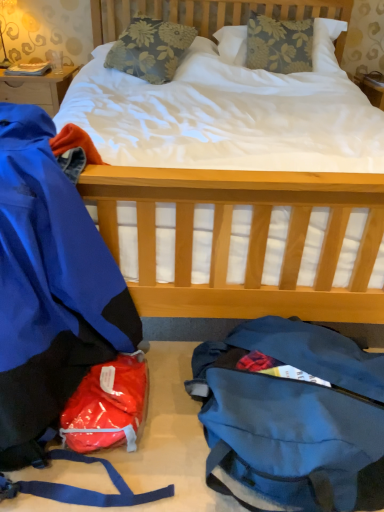
Question: In terms of height, does hardcover book at upper left look taller or shorter compared to blue waterproof jacket at left?

Choices:
 (A) short
 (B) tall

Answer: (A)

Question: Looking at the image, does hardcover book at upper left seem bigger or smaller compared to blue waterproof jacket at left?

Choices:
 (A) small
 (B) big

Answer: (A)

Question: Which object is positioned farthest from the blue waterproof jacket at left?

Choices:
 (A) hardcover book at upper left
 (B) matte gold lamp at upper left
 (C) wooden desk at upper left
 (D) floral fabric pillow at center, positioned as the second pillow in right-to-left order
 (E) shiny plastic bag at lower left

Answer: (B)

Question: Which object is positioned closest to the shiny plastic bag at lower left?

Choices:
 (A) matte gold lamp at upper left
 (B) blue waterproof jacket at left
 (C) floral fabric pillow at center, positioned as the second pillow in right-to-left order
 (D) floral fabric pillow at upper center, which is the second pillow in left-to-right order
 (E) hardcover book at upper left

Answer: (B)